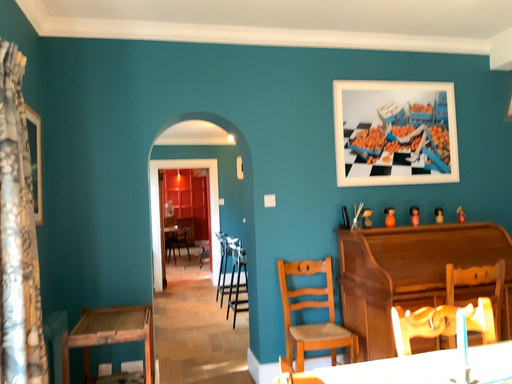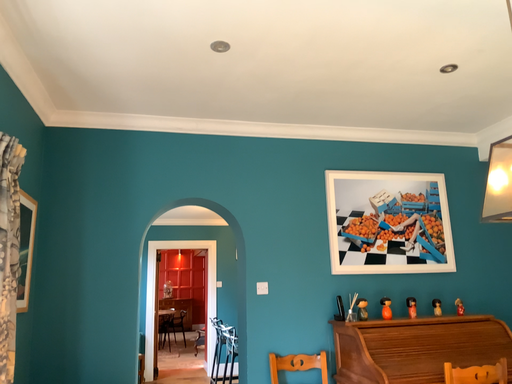
Question: How did the camera likely rotate when shooting the video?

Choices:
 (A) rotated downward
 (B) rotated upward

Answer: (B)